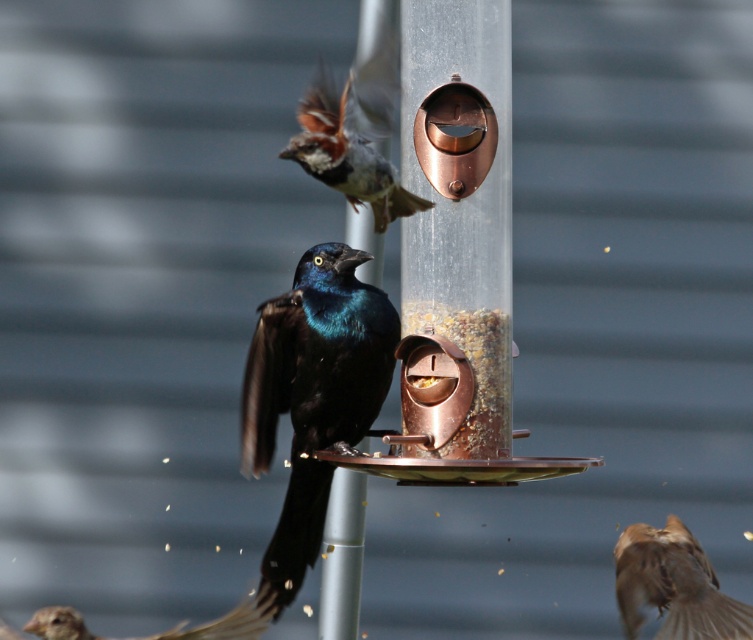
You are a photographer aiming to capture a closeup of the brown fluffy sparrow at lower right. Given that your camera can focus on subjects within 5 feet, will you need to move closer or farther away to get a clear shot?

The brown fluffy sparrow at lower right is 7.90 feet from camera. Since the camera focuses within 5 feet, you need to move closer to within 5 feet for a clear shot.

You are a small bird trying to reach the transparent plastic bird feeder at center. There is also a brown feathered sparrow at lower left nearby. Which object is larger and would provide more space for landing?

The transparent plastic bird feeder at center is bigger than the brown feathered sparrow at lower left, so it would provide more space for landing.

You are a birdwatcher observing the scene. You notice the shiny black bird at center and the brown feathered sparrow at lower left. Which bird is smaller in width?

The shiny black bird at center has a lesser width compared to the brown feathered sparrow at lower left, so the shiny black bird at center is smaller in width.